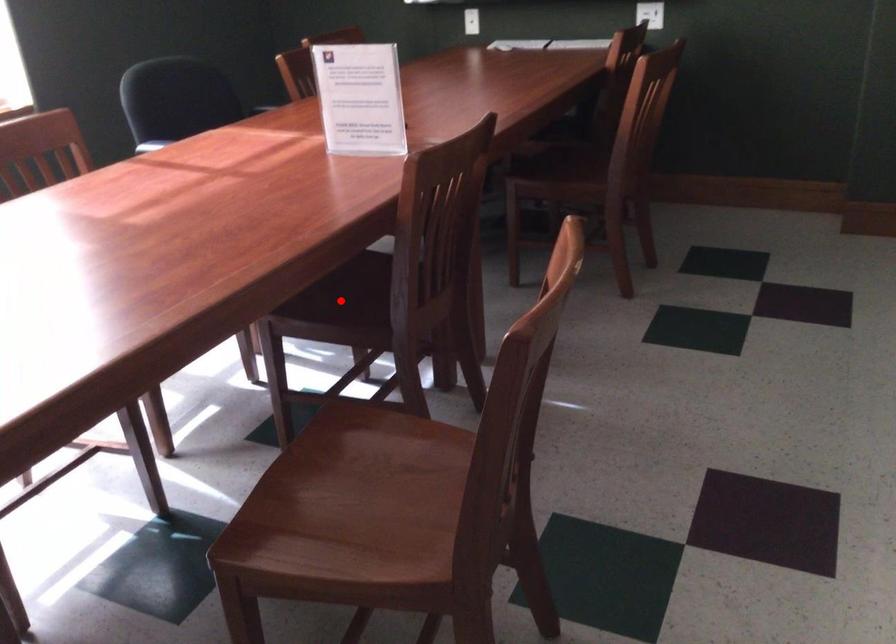
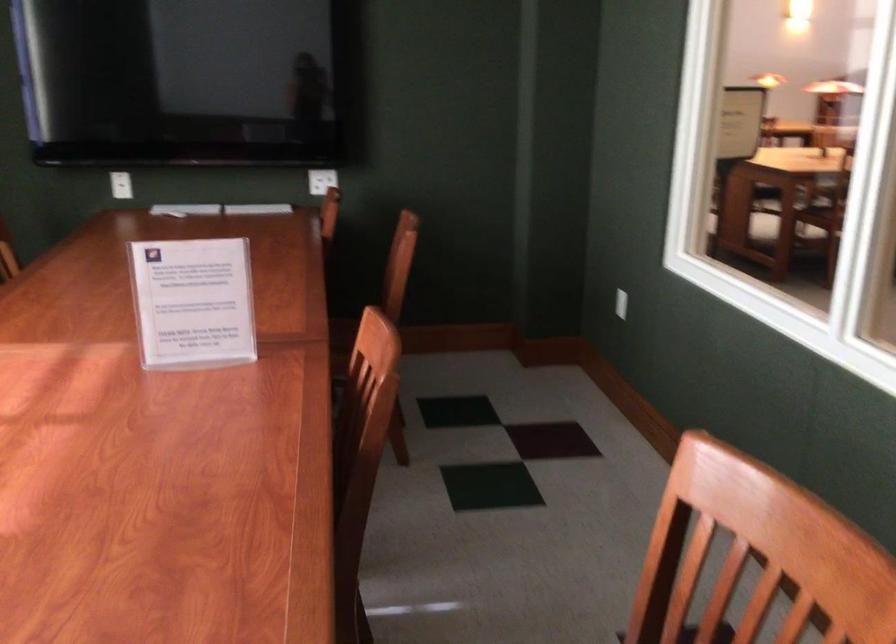
Question: I am providing you with two images of the same scene from different viewpoints. A red point is marked on the first image. Can you still see the location of the red point in image 2?

Choices:
 (A) Yes
 (B) No

Answer: (B)